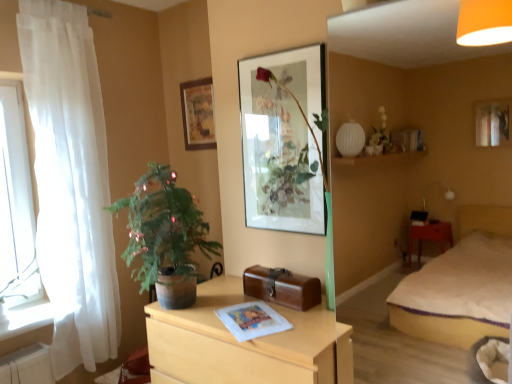
At what (x,y) coordinates should I click in order to perform the action: click on free location in front of brown leather suitcase at center. Please return your answer as a coordinate pair (x, y). The width and height of the screenshot is (512, 384). Looking at the image, I should click on click(x=287, y=322).